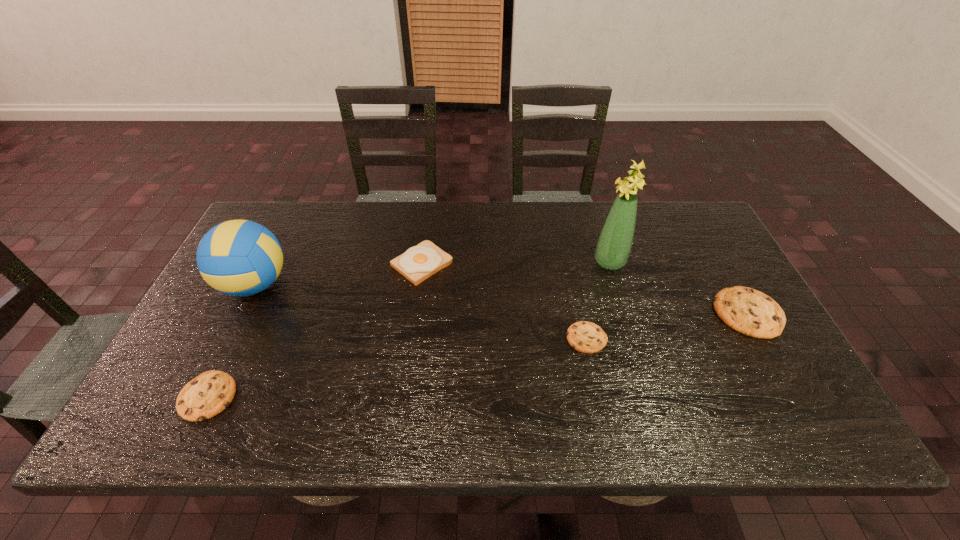
To make them evenly spaced by inserting another cookie among them, please locate a free space for this new cookie. Please provide its 2D coordinates. Your answer should be formatted as a tuple, i.e. [(x, y)], where the tuple contains the x and y coordinates of a point satisfying the conditions above.

[(408, 366)]